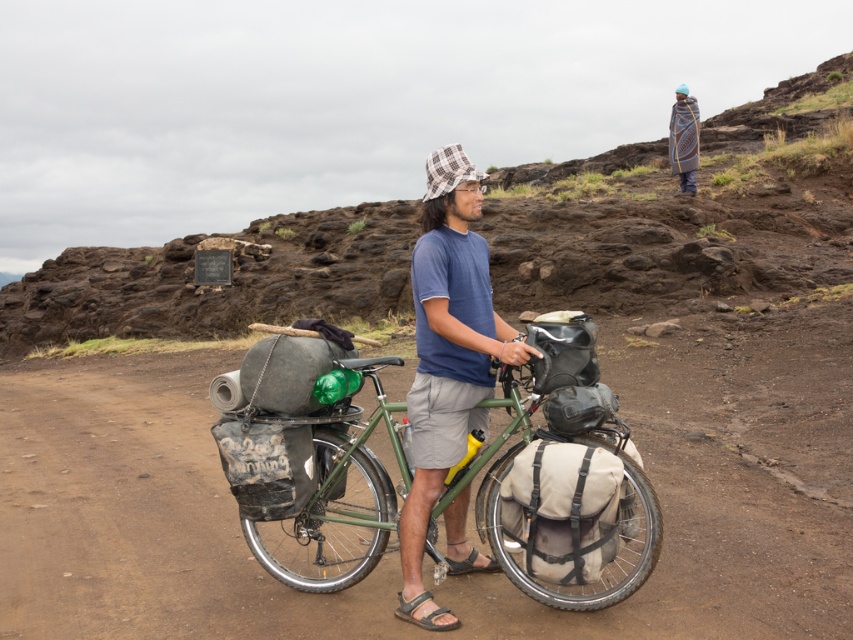
Does green matte bicycle at center appear on the left side of blue cotton shirt at center?

Indeed, green matte bicycle at center is positioned on the left side of blue cotton shirt at center.

Which is behind, point (495, 529) or point (434, 385)?

Point (495, 529)

The image size is (853, 640). Find the location of `green matte bicycle at center`. green matte bicycle at center is located at coordinates (572, 492).

Who is higher up, brown dirt track at center or blue cotton shirt at center?

blue cotton shirt at center is above.

Who is taller, brown dirt track at center or blue cotton shirt at center?

blue cotton shirt at center is taller.

This screenshot has height=640, width=853. Describe the element at coordinates (721, 486) in the screenshot. I see `brown dirt track at center` at that location.

Locate an element on the screen. This screenshot has height=640, width=853. brown dirt track at center is located at coordinates (721, 486).

Does brown dirt track at center have a smaller size compared to brown leather sandal at lower center?

No, brown dirt track at center is not smaller than brown leather sandal at lower center.

At what (x,y) coordinates should I click in order to perform the action: click on brown dirt track at center. Please return your answer as a coordinate pair (x, y). Looking at the image, I should click on (721, 486).